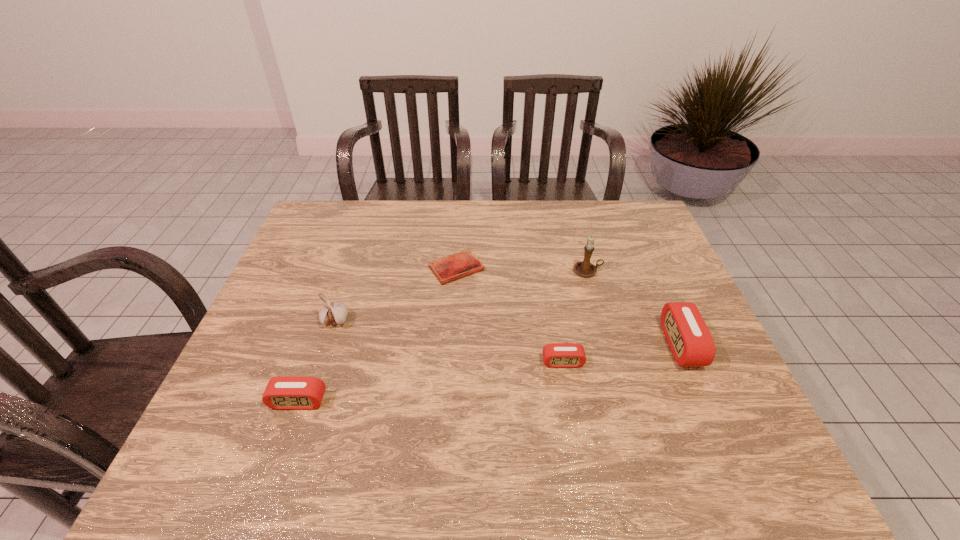
The height and width of the screenshot is (540, 960). What are the coordinates of `diary` in the screenshot? It's located at (453, 267).

Where is `vacant space located 0.150m on the front-facing side of the shortest alarm clock`? The height and width of the screenshot is (540, 960). vacant space located 0.150m on the front-facing side of the shortest alarm clock is located at coordinates (574, 426).

In order to click on blank area located 0.310m on the front-facing side of the rightmost alarm clock in this screenshot , I will do `click(544, 345)`.

Find the location of `vacant space situated on the front-facing side of the rightmost alarm clock`. vacant space situated on the front-facing side of the rightmost alarm clock is located at coordinates (596, 345).

Where is `vacant region located on the front-facing side of the rightmost alarm clock`? Image resolution: width=960 pixels, height=540 pixels. vacant region located on the front-facing side of the rightmost alarm clock is located at coordinates (544, 345).

This screenshot has width=960, height=540. In order to click on vacant area situated 0.060m on the side of the candle holder with the handle in this screenshot , I will do `click(622, 271)`.

This screenshot has height=540, width=960. What are the coordinates of `vacant space located 0.320m on the back of the garlic` in the screenshot? It's located at (362, 239).

This screenshot has width=960, height=540. I want to click on vacant space situated 0.220m on the left of the diary, so click(355, 268).

I want to click on object that is positioned at the near edge, so click(x=282, y=393).

The image size is (960, 540). Identify the location of object situated at the left edge. (282, 393).